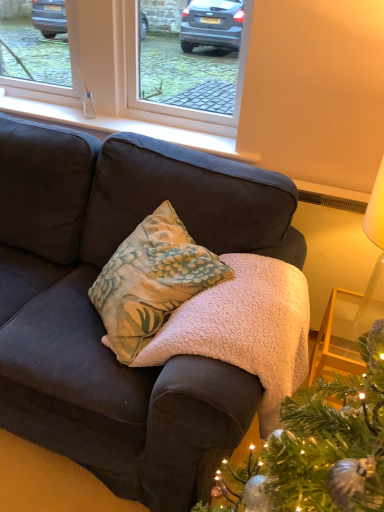
Question: Considering the relative sizes of white smooth window sill at upper center and white plastic window at upper center in the image provided, is white smooth window sill at upper center wider than white plastic window at upper center?

Choices:
 (A) yes
 (B) no

Answer: (A)

Question: Is white plastic window at upper center at the back of white smooth window sill at upper center?

Choices:
 (A) no
 (B) yes

Answer: (A)

Question: Is the depth of white smooth window sill at upper center less than that of white plastic window at upper center?

Choices:
 (A) yes
 (B) no

Answer: (B)

Question: From a real-world perspective, does white smooth window sill at upper center sit lower than white plastic window at upper center?

Choices:
 (A) no
 (B) yes

Answer: (B)

Question: Considering the relative sizes of white smooth window sill at upper center and white plastic window at upper center in the image provided, is white smooth window sill at upper center shorter than white plastic window at upper center?

Choices:
 (A) no
 (B) yes

Answer: (B)

Question: From a real-world perspective, is white paper lampshade at upper right above or below white smooth window sill at upper center?

Choices:
 (A) below
 (B) above

Answer: (A)

Question: In terms of width, does white paper lampshade at upper right look wider or thinner when compared to white smooth window sill at upper center?

Choices:
 (A) thin
 (B) wide

Answer: (B)

Question: Is point (344, 298) closer or farther from the camera than point (6, 100)?

Choices:
 (A) closer
 (B) farther

Answer: (A)

Question: Is white paper lampshade at upper right taller or shorter than white smooth window sill at upper center?

Choices:
 (A) tall
 (B) short

Answer: (A)

Question: Is white plastic window at upper center wider or thinner than white fleece blanket at center?

Choices:
 (A) wide
 (B) thin

Answer: (B)

Question: Is point (77, 41) positioned closer to the camera than point (152, 362)?

Choices:
 (A) farther
 (B) closer

Answer: (A)

Question: Choose the correct answer: Is white plastic window at upper center inside white fleece blanket at center or outside it?

Choices:
 (A) inside
 (B) outside

Answer: (B)

Question: In the image, is white plastic window at upper center positioned in front of or behind white fleece blanket at center?

Choices:
 (A) behind
 (B) front

Answer: (A)

Question: Looking at their shapes, would you say white smooth window sill at upper center is wider or thinner than white fleece blanket at center?

Choices:
 (A) thin
 (B) wide

Answer: (A)

Question: In terms of size, does white smooth window sill at upper center appear bigger or smaller than white fleece blanket at center?

Choices:
 (A) small
 (B) big

Answer: (A)